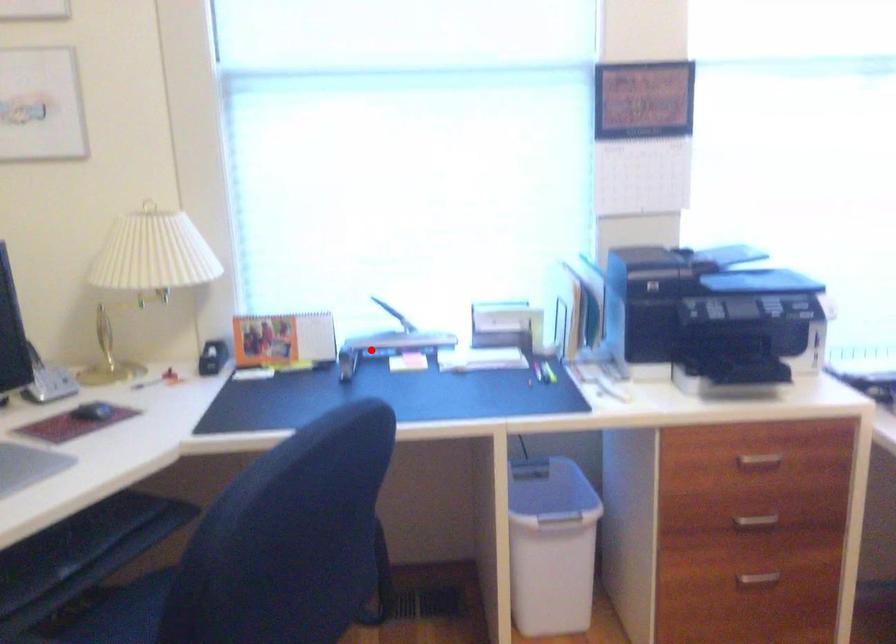
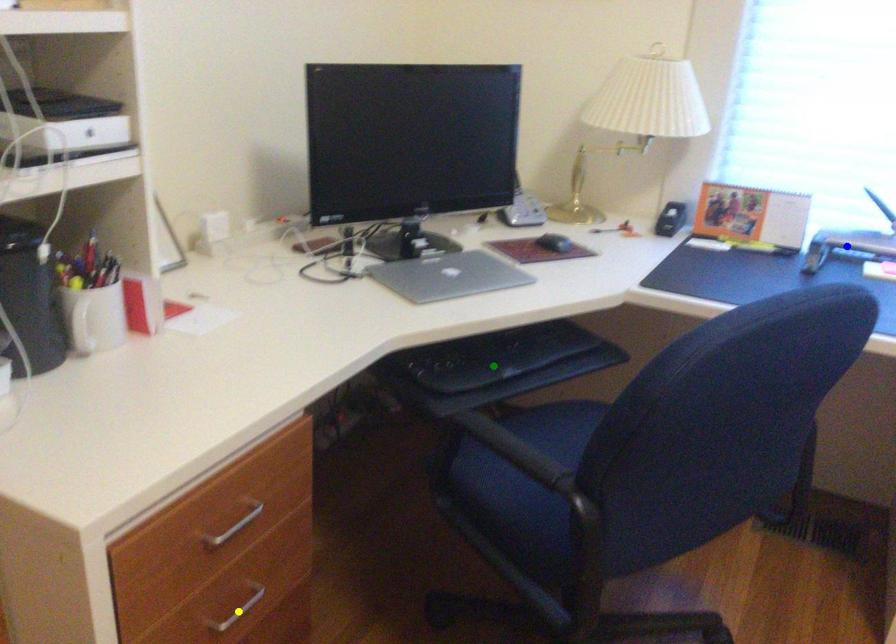
Question: I am providing you with two images of the same scene from different viewpoints. A red point is marked on the first image. You are given multiple points on the second image. Which spot in image 2 lines up with the point in image 1?

Choices:
 (A) blue point
 (B) green point
 (C) yellow point

Answer: (A)